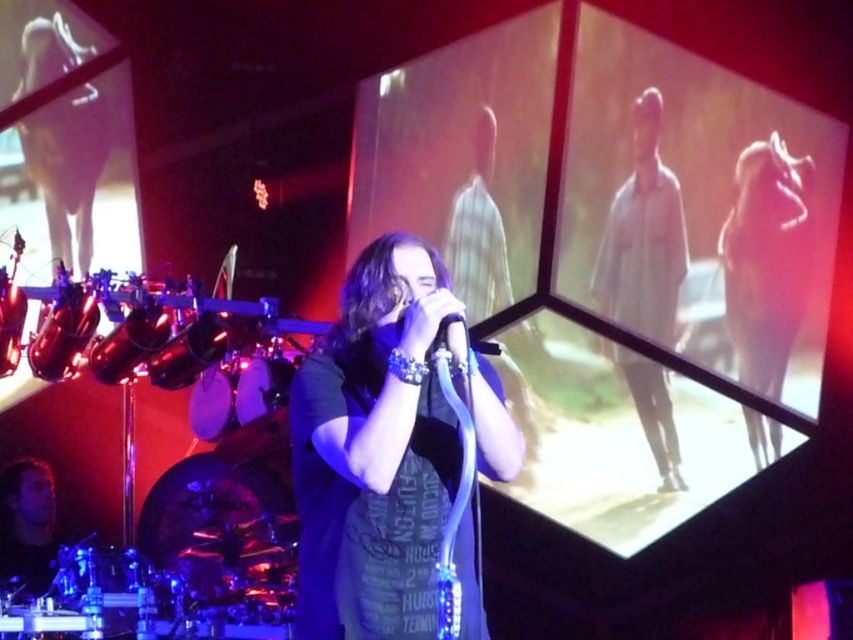
Does dark blue t-shirt at center appear over white matte dress at upper center?

Incorrect, dark blue t-shirt at center is not positioned above white matte dress at upper center.

Who is taller, dark blue t-shirt at center or white matte dress at upper center?

white matte dress at upper center is taller.

Identify the location of dark blue t-shirt at center. The height and width of the screenshot is (640, 853). (375, 449).

Identify the location of dark blue t-shirt at center. (375, 449).